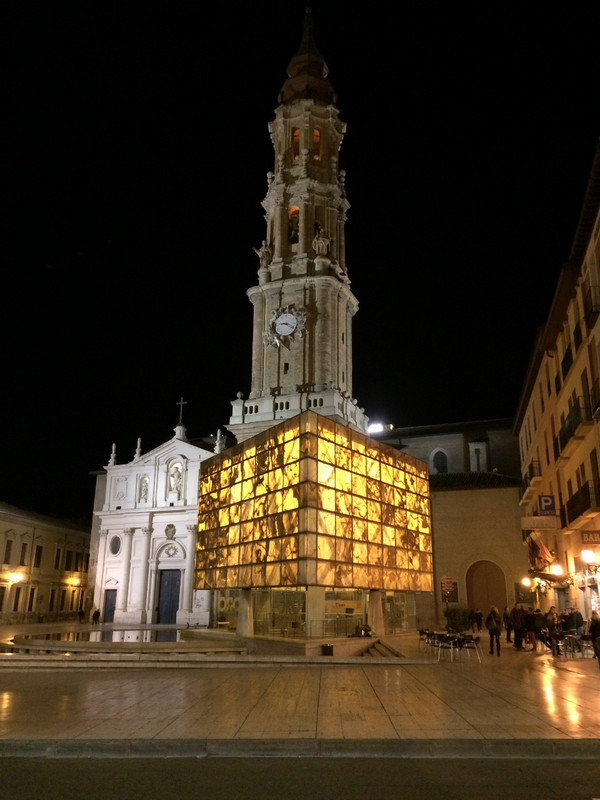
Find the location of a particular element. This screenshot has height=800, width=600. doorway is located at coordinates (161, 594), (492, 593).